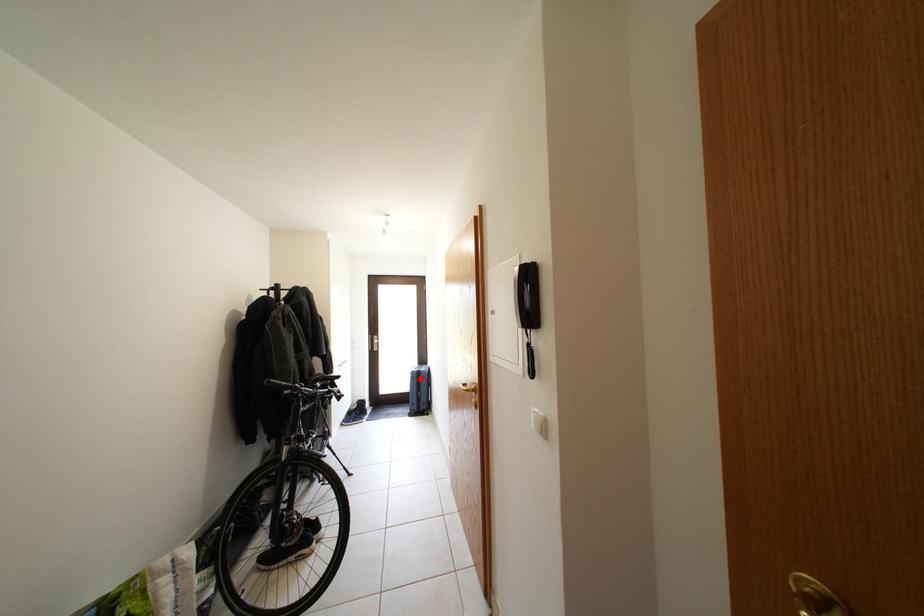
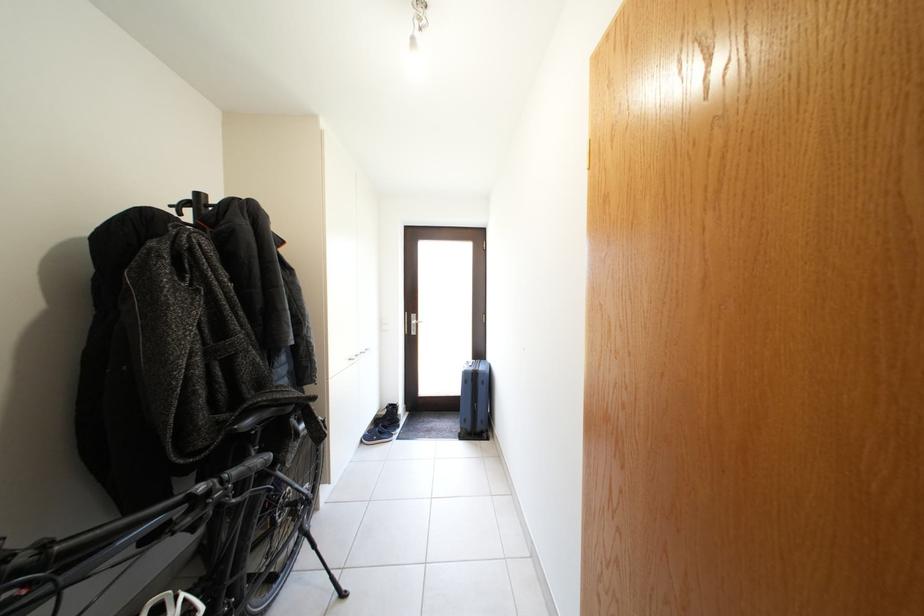
Where in the second image is the point corresponding to the highlighted location from the first image?

(473, 379)